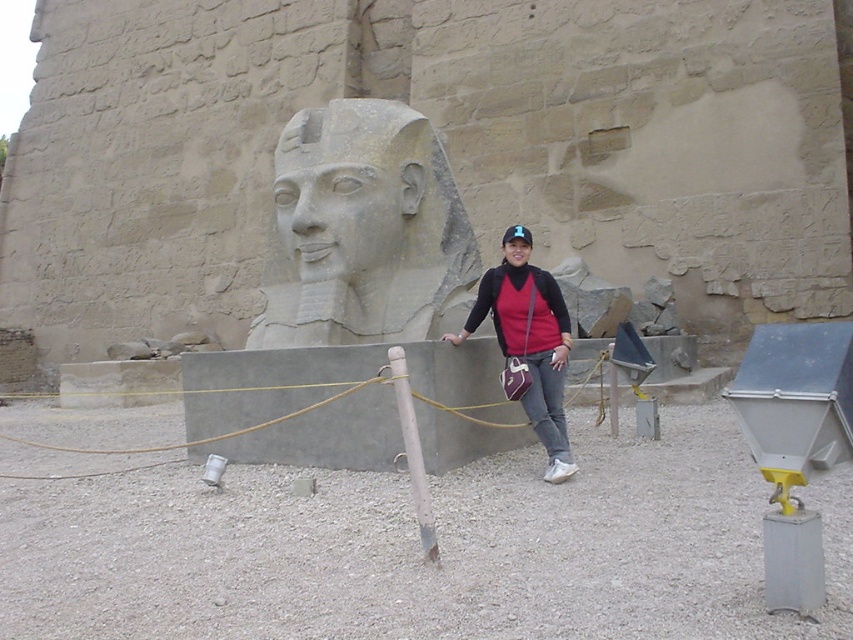
Question: Which object appears closest to the camera in this image?

Choices:
 (A) gray stone head at center
 (B) matte black sweatshirt at center
 (C) matte black jacket at center

Answer: (C)

Question: Is gray stone head at center smaller than matte black head at center?

Choices:
 (A) no
 (B) yes

Answer: (B)

Question: Is white wood pole at center wider than matte black head at center?

Choices:
 (A) no
 (B) yes

Answer: (A)

Question: Which object appears farthest from the camera in this image?

Choices:
 (A) white wood pole at center
 (B) matte black head at center

Answer: (B)

Question: Where is matte black jacket at center located in relation to white wood pole at center in the image?

Choices:
 (A) above
 (B) below

Answer: (A)

Question: Which of the following is the closest to the observer?

Choices:
 (A) (553, 333)
 (B) (401, 388)
 (C) (13, 440)
 (D) (549, 456)

Answer: (B)